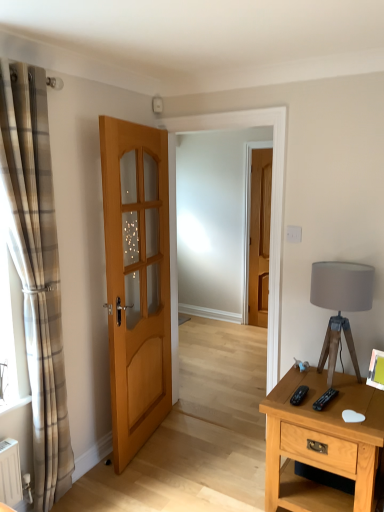
Where is `matte gray fabric lampshade at right`? matte gray fabric lampshade at right is located at coordinates (340, 305).

Measure the distance between point [252,193] and camera.

They are 4.58 meters apart.

I want to click on light brown wooden nightstand at right, so click(x=322, y=443).

Can we say matte wooden door at center, the first door when ordered from back to front, lies outside light brown wooden nightstand at right?

Yes, matte wooden door at center, the first door when ordered from back to front, is outside of light brown wooden nightstand at right.

Is matte wooden door at center, the 2th door viewed from the left, far from light brown wooden nightstand at right?

Absolutely, matte wooden door at center, the 2th door viewed from the left, is distant from light brown wooden nightstand at right.

Which is less distant, [251,323] or [270,393]?

The point [270,393] is closer.

Relative to light brown wooden nightstand at right, is matte wooden door at center, which ranks as the 2th door in front-to-back order, in front or behind?

matte wooden door at center, which ranks as the 2th door in front-to-back order, is behind light brown wooden nightstand at right.

What's the angular difference between light brown wooden door at center, the 1th door viewed from the front, and plaid fabric curtain at left's facing directions?

10.8 degrees separate the facing orientations of light brown wooden door at center, the 1th door viewed from the front, and plaid fabric curtain at left.

From a real-world perspective, who is located higher, light brown wooden door at center, the first door viewed from the left, or plaid fabric curtain at left?

plaid fabric curtain at left.

From the image's perspective, which object appears higher, light brown wooden door at center, the 1th door viewed from the front, or plaid fabric curtain at left?

light brown wooden door at center, the 1th door viewed from the front, appears higher in the image.

Between light brown wooden door at center, acting as the second door starting from the back, and plaid fabric curtain at left, which one has less height?

light brown wooden door at center, acting as the second door starting from the back, is shorter.

Based on their positions, is plaid fabric curtain at left located to the left or right of light brown wooden nightstand at right?

plaid fabric curtain at left is to the left of light brown wooden nightstand at right.

Measure the distance from plaid fabric curtain at left to light brown wooden nightstand at right.

plaid fabric curtain at left and light brown wooden nightstand at right are 1.29 meters apart from each other.

Can you see plaid fabric curtain at left touching light brown wooden nightstand at right?

No, plaid fabric curtain at left is not touching light brown wooden nightstand at right.

This screenshot has width=384, height=512. I want to click on curtain that appears above the light brown wooden nightstand at right (from a real-world perspective), so click(37, 270).

Considering the sizes of plaid fabric curtain at left and matte wooden door at center, the first door when ordered from back to front, in the image, is plaid fabric curtain at left wider or thinner than matte wooden door at center, the first door when ordered from back to front,?

Considering their sizes, plaid fabric curtain at left looks broader than matte wooden door at center, the first door when ordered from back to front.

From a real-world perspective, is plaid fabric curtain at left positioned above or below matte wooden door at center, the first door when ordered from back to front?

plaid fabric curtain at left is above matte wooden door at center, the first door when ordered from back to front.

From the image's perspective, which one is positioned lower, plaid fabric curtain at left or matte wooden door at center, the first door when ordered from back to front?

From the image's view, plaid fabric curtain at left is below.

Looking at this image, looking at the image, does plaid fabric curtain at left seem bigger or smaller compared to matte wooden door at center, the 2th door viewed from the left?

In the image, plaid fabric curtain at left appears to be larger than matte wooden door at center, the 2th door viewed from the left.

Is matte gray fabric lampshade at right oriented towards matte wooden door at center, which ranks as the 2th door in front-to-back order?

No, matte gray fabric lampshade at right is not facing towards matte wooden door at center, which ranks as the 2th door in front-to-back order.

Considering the positions of objects matte gray fabric lampshade at right and matte wooden door at center, which is the first door from right to left, in the image provided, who is more to the left, matte gray fabric lampshade at right or matte wooden door at center, which is the first door from right to left,?

matte wooden door at center, which is the first door from right to left, is more to the left.

Where is `table lamp below the matte wooden door at center, which ranks as the 2th door in front-to-back order (from a real-world perspective)`? table lamp below the matte wooden door at center, which ranks as the 2th door in front-to-back order (from a real-world perspective) is located at coordinates (340, 305).

Can you tell me how much light brown wooden nightstand at right and light brown wooden door at center, the second door from the right, differ in facing direction?

The angle between the facing direction of light brown wooden nightstand at right and the facing direction of light brown wooden door at center, the second door from the right, is 101 degrees.

From the image's perspective, which one is positioned lower, light brown wooden nightstand at right or light brown wooden door at center, the 1th door viewed from the front?

light brown wooden nightstand at right appears lower in the image.

From the picture: Can you confirm if light brown wooden nightstand at right is wider than light brown wooden door at center, the first door viewed from the left?

Yes.

Which is more distant, (302, 456) or (155, 398)?

The point (155, 398) is farther.

Is light brown wooden nightstand at right facing towards matte gray fabric lampshade at right?

No, light brown wooden nightstand at right is not turned towards matte gray fabric lampshade at right.

Between light brown wooden nightstand at right and matte gray fabric lampshade at right, which one has more height?

Standing taller between the two is matte gray fabric lampshade at right.

Looking at this image, is light brown wooden nightstand at right touching matte gray fabric lampshade at right?

No, light brown wooden nightstand at right is not beside matte gray fabric lampshade at right.

The height and width of the screenshot is (512, 384). I want to click on nightstand below the matte wooden door at center, the 2th door viewed from the left (from a real-world perspective), so click(322, 443).

From the image's perspective, starting from the plaid fabric curtain at left, which door is the 1st one above? Please provide its 2D coordinates.

[(136, 280)]

In the scene shown: Looking at the image, which one is located closer to light brown wooden door at center, acting as the second door starting from the back, matte gray fabric lampshade at right or matte wooden door at center, which is the first door from right to left?

matte gray fabric lampshade at right is positioned closer to the anchor light brown wooden door at center, acting as the second door starting from the back.

Estimate the real-world distances between objects in this image. Which object is closer to matte wooden door at center, which ranks as the 2th door in front-to-back order, light brown wooden door at center, the second door from the right, or plaid fabric curtain at left?

Among the two, light brown wooden door at center, the second door from the right, is located nearer to matte wooden door at center, which ranks as the 2th door in front-to-back order.

Based on their spatial positions, is light brown wooden nightstand at right or matte gray fabric lampshade at right further from matte wooden door at center, the 2th door viewed from the left?

light brown wooden nightstand at right lies further to matte wooden door at center, the 2th door viewed from the left, than the other object.

Based on their spatial positions, is plaid fabric curtain at left or light brown wooden nightstand at right further from matte gray fabric lampshade at right?

The object further to matte gray fabric lampshade at right is plaid fabric curtain at left.

Considering their positions, is matte gray fabric lampshade at right positioned further to plaid fabric curtain at left than light brown wooden nightstand at right?

The object further to plaid fabric curtain at left is matte gray fabric lampshade at right.

From the image, which object appears to be nearer to plaid fabric curtain at left, matte gray fabric lampshade at right or matte wooden door at center, the first door when ordered from back to front?

Based on the image, matte gray fabric lampshade at right appears to be nearer to plaid fabric curtain at left.

Looking at the image, which one is located further to light brown wooden nightstand at right, matte gray fabric lampshade at right or matte wooden door at center, the 2th door viewed from the left?

matte wooden door at center, the 2th door viewed from the left, is further to light brown wooden nightstand at right.

Based on their spatial positions, is matte wooden door at center, which ranks as the 2th door in front-to-back order, or light brown wooden door at center, the second door from the right, closer to plaid fabric curtain at left?

light brown wooden door at center, the second door from the right, is closer to plaid fabric curtain at left.

I want to click on table lamp between light brown wooden nightstand at right and matte wooden door at center, the first door when ordered from back to front, in the front-back direction, so click(x=340, y=305).

The height and width of the screenshot is (512, 384). I want to click on nightstand between light brown wooden door at center, acting as the second door starting from the back, and matte gray fabric lampshade at right from left to right, so click(322, 443).

I want to click on nightstand located between plaid fabric curtain at left and matte gray fabric lampshade at right in the left-right direction, so click(x=322, y=443).

This screenshot has width=384, height=512. Identify the location of door positioned between plaid fabric curtain at left and matte wooden door at center, which ranks as the 2th door in front-to-back order, from near to far. (136, 280).